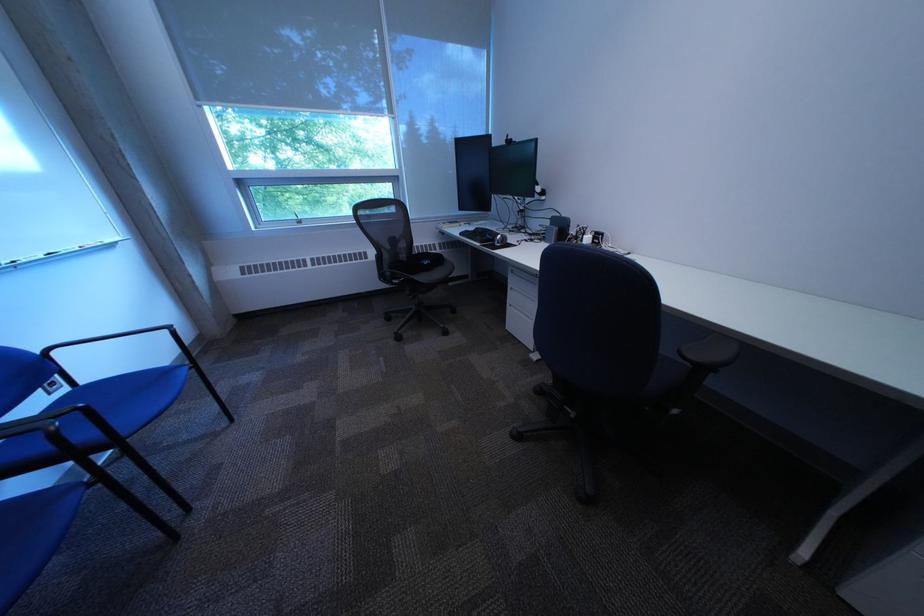
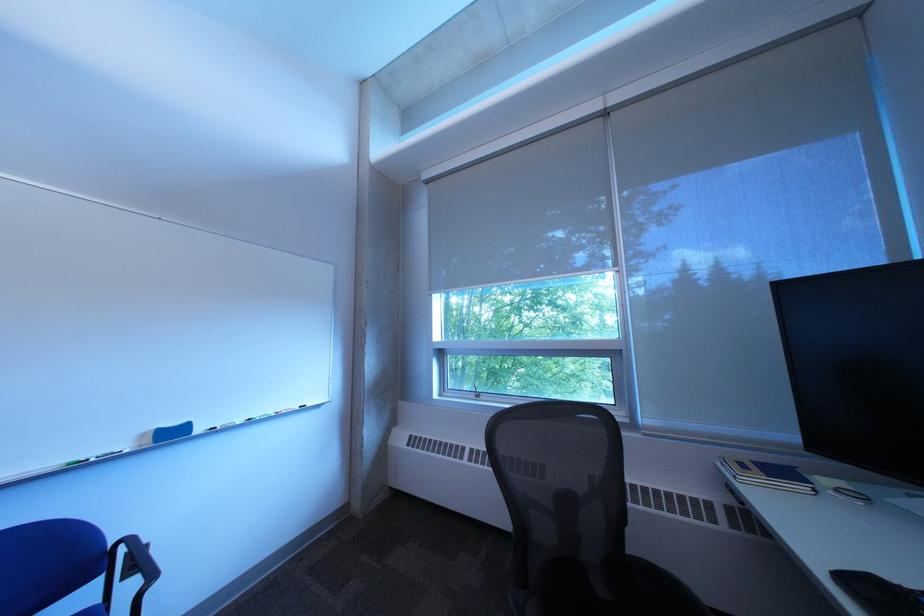
In the second image, find the point that corresponds to [477,236] in the first image.

(860, 582)